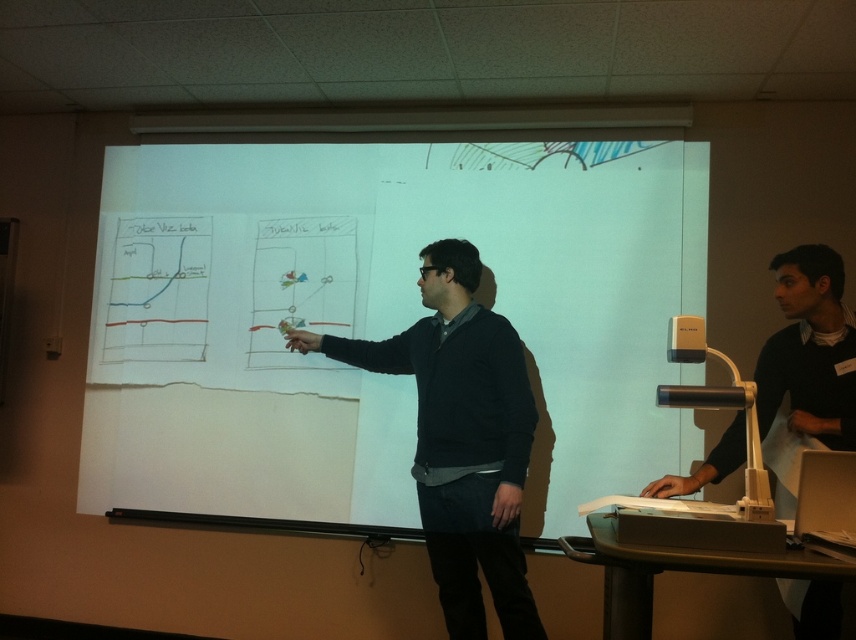
Question: Can you confirm if white matte projection screen at center is positioned below dark blue sweater at center?

Choices:
 (A) no
 (B) yes

Answer: (A)

Question: Based on their relative distances, which object is nearer to the dark blue sweater at center?

Choices:
 (A) matte white projector at lower center
 (B) white matte projection screen at center

Answer: (B)

Question: Among these objects, which one is nearest to the camera?

Choices:
 (A) dark blue sweater at center
 (B) matte white projector at lower center
 (C) white matte projection screen at center

Answer: (B)

Question: From the image, what is the correct spatial relationship of white matte projection screen at center in relation to dark blue sweater at center?

Choices:
 (A) left
 (B) right

Answer: (A)

Question: Can you confirm if white matte projection screen at center is positioned to the left of dark blue sweater at center?

Choices:
 (A) yes
 (B) no

Answer: (A)

Question: Considering the real-world distances, which object is closest to the matte white projector at lower center?

Choices:
 (A) dark blue sweater at center
 (B) white matte projection screen at center

Answer: (A)